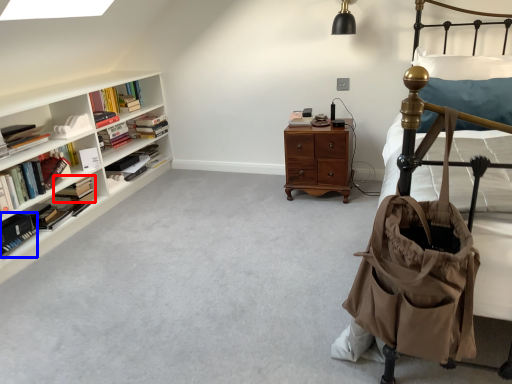
Question: Which point is closer to the camera, book (highlighted by a red box) or book (highlighted by a blue box)?

Choices:
 (A) book
 (B) book

Answer: (B)